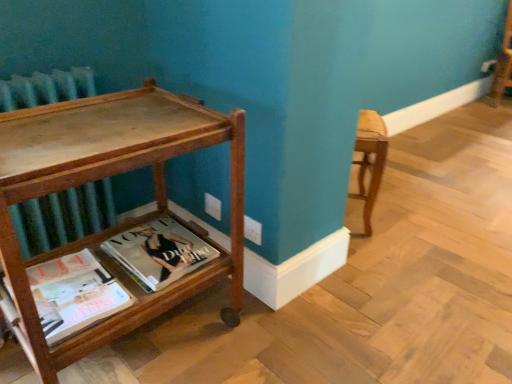
Question: Is matte paper magazine at lower left, the first book when ordered from front to back, completely or partially outside of matte hardcover book at lower center, which ranks as the first book in back-to-front order?

Choices:
 (A) no
 (B) yes

Answer: (B)

Question: Can you confirm if matte paper magazine at lower left, the second book from the back, is smaller than matte hardcover book at lower center, the 2th book in the front-to-back sequence?

Choices:
 (A) no
 (B) yes

Answer: (B)

Question: Is matte hardcover book at lower center, which ranks as the first book in back-to-front order, surrounded by matte paper magazine at lower left, the second book from the back?

Choices:
 (A) yes
 (B) no

Answer: (B)

Question: Is the depth of matte paper magazine at lower left, the first book when ordered from front to back, greater than that of matte hardcover book at lower center, which ranks as the first book in back-to-front order?

Choices:
 (A) no
 (B) yes

Answer: (A)

Question: Can you confirm if matte paper magazine at lower left, the second book from the back, is positioned to the right of matte hardcover book at lower center, the 2th book in the front-to-back sequence?

Choices:
 (A) yes
 (B) no

Answer: (B)

Question: Visually, is matte hardcover book at lower center, the 2th book in the front-to-back sequence, positioned to the left or to the right of matte paper magazine at lower left, the second book from the back?

Choices:
 (A) right
 (B) left

Answer: (A)

Question: In the image, is matte hardcover book at lower center, the 2th book in the front-to-back sequence, positioned in front of or behind matte paper magazine at lower left, the first book when ordered from front to back?

Choices:
 (A) behind
 (B) front

Answer: (A)

Question: Is matte hardcover book at lower center, which ranks as the first book in back-to-front order, wider or thinner than matte paper magazine at lower left, the first book when ordered from front to back?

Choices:
 (A) thin
 (B) wide

Answer: (A)

Question: Does point pyautogui.click(x=162, y=253) appear closer or farther from the camera than point pyautogui.click(x=75, y=312)?

Choices:
 (A) closer
 (B) farther

Answer: (B)

Question: Based on their positions, is matte hardcover book at lower center, the 2th book in the front-to-back sequence, located to the left or right of wooden table at left?

Choices:
 (A) left
 (B) right

Answer: (B)

Question: Based on their sizes in the image, would you say matte hardcover book at lower center, which ranks as the first book in back-to-front order, is bigger or smaller than wooden table at left?

Choices:
 (A) small
 (B) big

Answer: (A)

Question: From a real-world perspective, is matte hardcover book at lower center, the 2th book in the front-to-back sequence, physically located above or below wooden table at left?

Choices:
 (A) below
 (B) above

Answer: (A)

Question: Considering their positions, is matte hardcover book at lower center, which ranks as the first book in back-to-front order, located in front of or behind wooden table at left?

Choices:
 (A) front
 (B) behind

Answer: (B)

Question: Would you say matte paper magazine at lower left, the second book from the back, is inside or outside matte hardcover book at lower center, the 2th book in the front-to-back sequence?

Choices:
 (A) inside
 (B) outside

Answer: (B)

Question: Visually, is matte paper magazine at lower left, the second book from the back, positioned to the left or to the right of matte hardcover book at lower center, which ranks as the first book in back-to-front order?

Choices:
 (A) left
 (B) right

Answer: (A)